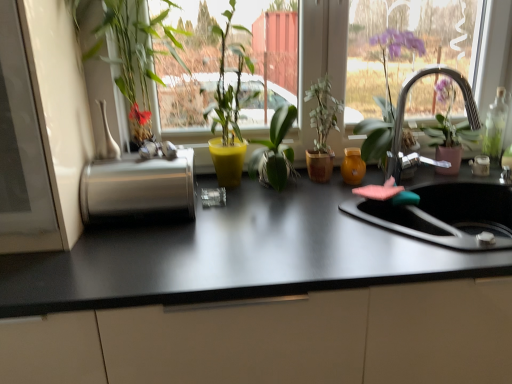
What is the approximate width of matte white vase at left, which appears as the 1th houseplant when viewed from the left?

32.65 centimeters.

What do you see at coordinates (134, 56) in the screenshot?
I see `matte white vase at left, positioned as the 4th houseplant in right-to-left order` at bounding box center [134, 56].

What are the coordinates of `black matte countertop at center` in the screenshot? It's located at (232, 256).

I want to click on transparent glass window at center, so click(x=329, y=63).

At what (x,y) coordinates should I click in order to perform the action: click on white glossy vase at upper left, the second vase in the right-to-left sequence. Please return your answer as a coordinate pair (x, y). The height and width of the screenshot is (384, 512). Looking at the image, I should click on (108, 134).

What's the angular difference between transparent glass bottle at right and green matte plant at center, which is the second houseplant from right to left,'s facing directions?

There is a 0.0585-degree angle between the facing directions of transparent glass bottle at right and green matte plant at center, which is the second houseplant from right to left.

From a real-world perspective, is transparent glass bottle at right below green matte plant at center, the 3th houseplant from the left?

Result: No, from a real-world perspective, transparent glass bottle at right is not beneath green matte plant at center, the 3th houseplant from the left.

Could you tell me if transparent glass bottle at right is turned towards green matte plant at center, which is the second houseplant from right to left?

No.

Does transparent glass bottle at right appear on the left side of green matte plant at center, which is the second houseplant from right to left?

No.

Looking at their sizes, would you say pink sponge at right is wider or thinner than brushed metal paper towel holder at left?

Considering their sizes, pink sponge at right looks slimmer than brushed metal paper towel holder at left.

Is pink sponge at right turned away from brushed metal paper towel holder at left?

No.

Between pink sponge at right and brushed metal paper towel holder at left, which one appears on the left side from the viewer's perspective?

Positioned to the left is brushed metal paper towel holder at left.

Can you tell me how much transparent glass bottle at right and translucent amber glass at sink right, marked as the second vase in a front-to-back arrangement, differ in facing direction?

There is a 3.94-degree angle between the facing directions of transparent glass bottle at right and translucent amber glass at sink right, marked as the second vase in a front-to-back arrangement.

In the image, is transparent glass bottle at right positioned in front of or behind translucent amber glass at sink right, which ranks as the second vase in left-to-right order?

Visually, transparent glass bottle at right is located behind translucent amber glass at sink right, which ranks as the second vase in left-to-right order.

Considering the sizes of transparent glass bottle at right and translucent amber glass at sink right, which ranks as the 1th vase in back-to-front order, in the image, is transparent glass bottle at right wider or thinner than translucent amber glass at sink right, which ranks as the 1th vase in back-to-front order,?

Clearly, transparent glass bottle at right has less width compared to translucent amber glass at sink right, which ranks as the 1th vase in back-to-front order.

Who is bigger, transparent glass bottle at right or translucent amber glass at sink right, which is the 1th vase from right to left?

transparent glass bottle at right is bigger.

From a real-world perspective, who is located lower, brushed metal paper towel holder at left or translucent amber glass at sink right, which ranks as the second vase in left-to-right order?

From a 3D spatial view, translucent amber glass at sink right, which ranks as the second vase in left-to-right order, is below.

Between brushed metal paper towel holder at left and translucent amber glass at sink right, which ranks as the second vase in left-to-right order, which one appears on the right side from the viewer's perspective?

From the viewer's perspective, translucent amber glass at sink right, which ranks as the second vase in left-to-right order, appears more on the right side.

Is point (165, 166) more distant than point (349, 173)?

No, (165, 166) is in front of (349, 173).

Are brushed metal paper towel holder at left and translucent amber glass at sink right, which ranks as the second vase in left-to-right order, making contact?

brushed metal paper towel holder at left is not next to translucent amber glass at sink right, which ranks as the second vase in left-to-right order, and they're not touching.

Consider the image. Is silver metallic faucet at upper right touching translucent amber glass at sink right, marked as the second vase in a front-to-back arrangement?

No, silver metallic faucet at upper right is not touching translucent amber glass at sink right, marked as the second vase in a front-to-back arrangement.

From a real-world perspective, is silver metallic faucet at upper right below translucent amber glass at sink right, which ranks as the second vase in left-to-right order?

Incorrect, from a real-world perspective, silver metallic faucet at upper right is higher than translucent amber glass at sink right, which ranks as the second vase in left-to-right order.

Is silver metallic faucet at upper right facing towards translucent amber glass at sink right, which ranks as the second vase in left-to-right order?

No, silver metallic faucet at upper right does not turn towards translucent amber glass at sink right, which ranks as the second vase in left-to-right order.

From the image's perspective, between silver metallic faucet at upper right and translucent amber glass at sink right, which is the 1th vase from right to left, which one is located above?

From the image's view, silver metallic faucet at upper right is above.

Looking at this image, in terms of height, does transparent glass bottle at right look taller or shorter compared to matte white vase at left, positioned as the 4th houseplant in right-to-left order?

Considering their sizes, transparent glass bottle at right has less height than matte white vase at left, positioned as the 4th houseplant in right-to-left order.

Considering the relative positions of transparent glass bottle at right and matte white vase at left, positioned as the 4th houseplant in right-to-left order, in the image provided, is transparent glass bottle at right to the right of matte white vase at left, positioned as the 4th houseplant in right-to-left order, from the viewer's perspective?

Yes, transparent glass bottle at right is to the right of matte white vase at left, positioned as the 4th houseplant in right-to-left order.

Are transparent glass bottle at right and matte white vase at left, which appears as the 1th houseplant when viewed from the left, making contact?

transparent glass bottle at right is not next to matte white vase at left, which appears as the 1th houseplant when viewed from the left, and they're not touching.

Based on the photo, would you say transparent glass bottle at right is outside matte white vase at left, which appears as the 1th houseplant when viewed from the left?

transparent glass bottle at right is positioned outside matte white vase at left, which appears as the 1th houseplant when viewed from the left.

Can you confirm if matte yellow pot at center, positioned as the 3th houseplant in right-to-left order, is positioned to the left of brushed metal paper towel holder at left?

No, matte yellow pot at center, positioned as the 3th houseplant in right-to-left order, is not to the left of brushed metal paper towel holder at left.

Considering the relative sizes of matte yellow pot at center, acting as the second houseplant starting from the left, and brushed metal paper towel holder at left in the image provided, is matte yellow pot at center, acting as the second houseplant starting from the left, bigger than brushed metal paper towel holder at left?

Indeed, matte yellow pot at center, acting as the second houseplant starting from the left, has a larger size compared to brushed metal paper towel holder at left.

Which point is more distant from viewer, (218, 182) or (113, 164)?

The point (218, 182) is more distant.

Consider the image. How much distance is there between matte yellow pot at center, acting as the second houseplant starting from the left, and brushed metal paper towel holder at left?

A distance of 16.07 inches exists between matte yellow pot at center, acting as the second houseplant starting from the left, and brushed metal paper towel holder at left.

The height and width of the screenshot is (384, 512). Find the location of `the 2nd houseplant to the left when counting from the transparent glass bottle at right`. the 2nd houseplant to the left when counting from the transparent glass bottle at right is located at coordinates (275, 151).

You are a GUI agent. You are given a task and a screenshot of the screen. Output one action in this format:
    pyautogui.click(x=<x>, y=<y>)
    Task: Click on the appliance that is under the pink sponge at right (from a real-world perspective)
    
    Given the screenshot: What is the action you would take?
    pyautogui.click(x=138, y=188)

Which object lies further to the anchor point green matte plant at center, which is the first houseplant in right-to-left order, silver metallic faucet at upper right or matte white vase at left, positioned as the 4th houseplant in right-to-left order?

matte white vase at left, positioned as the 4th houseplant in right-to-left order, is further to green matte plant at center, which is the first houseplant in right-to-left order.

Estimate the real-world distances between objects in this image. Which object is closer to translucent amber glass at sink right, which ranks as the 1th vase in back-to-front order, green matte plant at center, the fourth houseplant from the left, or green matte plant at center, which is the second houseplant from right to left?

green matte plant at center, the fourth houseplant from the left, is positioned closer to the anchor translucent amber glass at sink right, which ranks as the 1th vase in back-to-front order.

Estimate the real-world distances between objects in this image. Which object is closer to silver metallic faucet at upper right, transparent glass bottle at right or brushed metal paper towel holder at left?

transparent glass bottle at right is positioned closer to the anchor silver metallic faucet at upper right.

Which object lies nearer to the anchor point matte yellow pot at center, acting as the second houseplant starting from the left, black matte countertop at center or transparent glass window at center?

Based on the image, transparent glass window at center appears to be nearer to matte yellow pot at center, acting as the second houseplant starting from the left.

Based on the photo, based on their spatial positions, is transparent glass bottle at right or black matte countertop at center closer to transparent glass window at center?

black matte countertop at center is positioned closer to the anchor transparent glass window at center.

From the picture: Which object lies further to the anchor point matte white vase at left, positioned as the 4th houseplant in right-to-left order, matte yellow pot at center, positioned as the 3th houseplant in right-to-left order, or silver metallic faucet at upper right?

Based on the image, silver metallic faucet at upper right appears to be further to matte white vase at left, positioned as the 4th houseplant in right-to-left order.

When comparing their distances from transparent glass window at center, does black matte countertop at center or green matte plant at center, the fourth houseplant from the left, seem closer?

green matte plant at center, the fourth houseplant from the left, is closer to transparent glass window at center.

Looking at the image, which one is located closer to white glossy vase at upper left, positioned as the 2th vase in back-to-front order, translucent amber glass at sink right, which ranks as the 1th vase in back-to-front order, or black matte countertop at center?

Among the two, black matte countertop at center is located nearer to white glossy vase at upper left, positioned as the 2th vase in back-to-front order.

The width and height of the screenshot is (512, 384). In order to click on houseplant between white glossy vase at upper left, which is the first vase in left-to-right order, and matte yellow pot at center, positioned as the 3th houseplant in right-to-left order in this screenshot , I will do `click(134, 56)`.

I want to click on window located between matte white vase at left, which appears as the 1th houseplant when viewed from the left, and silver metallic faucet at upper right in the left-right direction, so click(329, 63).

Where is `vase situated between white glossy vase at upper left, the second vase in the right-to-left sequence, and silver metallic faucet at upper right from left to right`? vase situated between white glossy vase at upper left, the second vase in the right-to-left sequence, and silver metallic faucet at upper right from left to right is located at coordinates (353, 166).

At what (x,y) coordinates should I click in order to perform the action: click on countertop between brushed metal paper towel holder at left and transparent glass bottle at right from left to right. Please return your answer as a coordinate pair (x, y). Looking at the image, I should click on (232, 256).